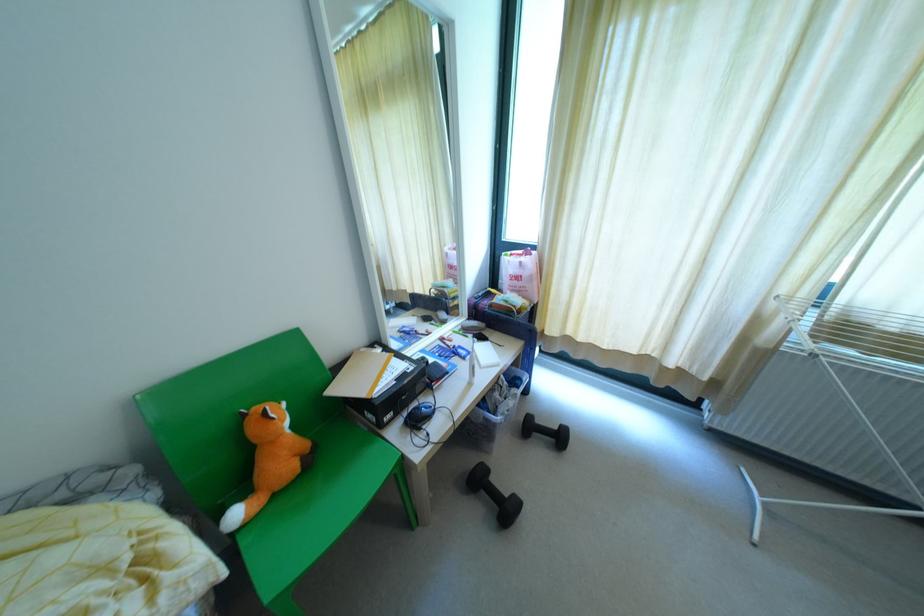
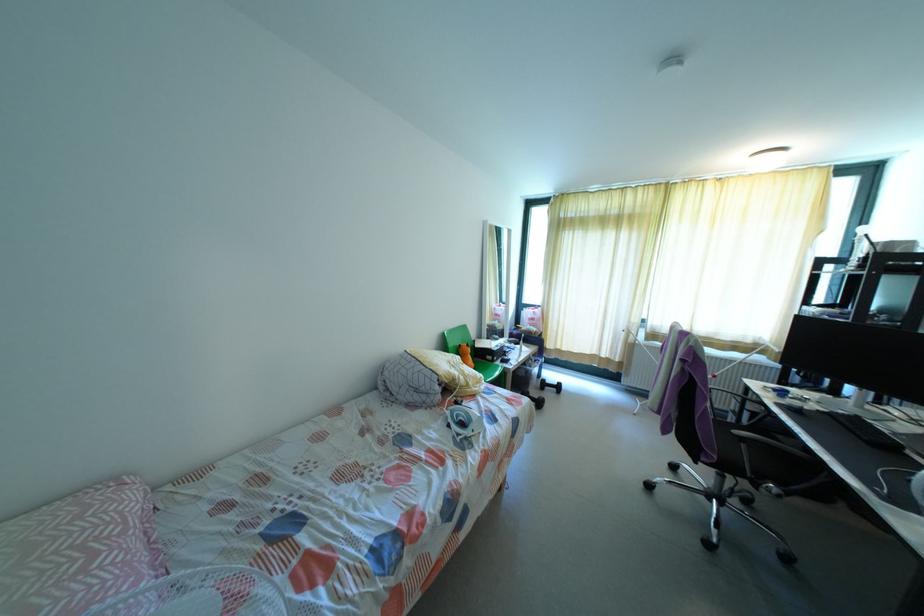
Find the pixel in the second image that matches pixel 242 415 in the first image.

(458, 345)